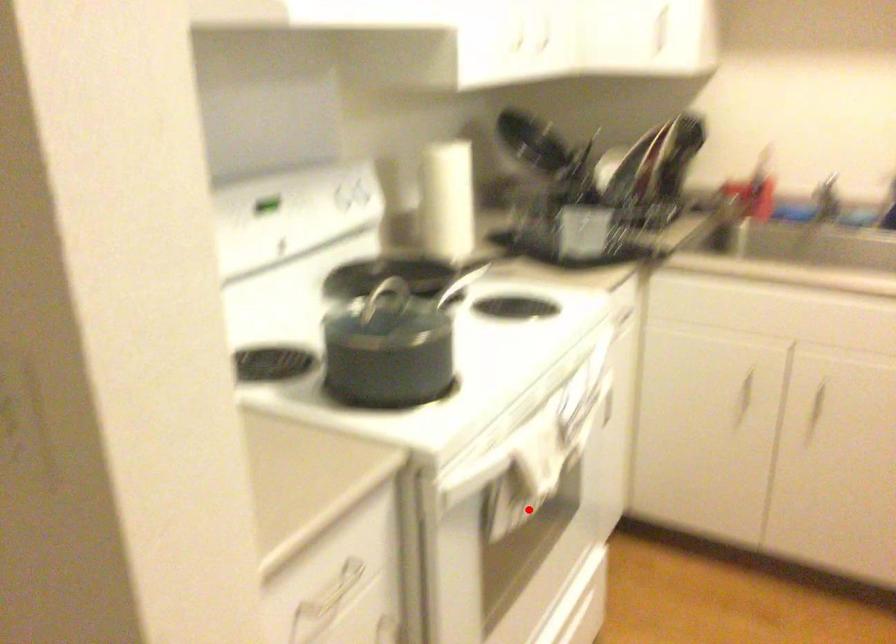
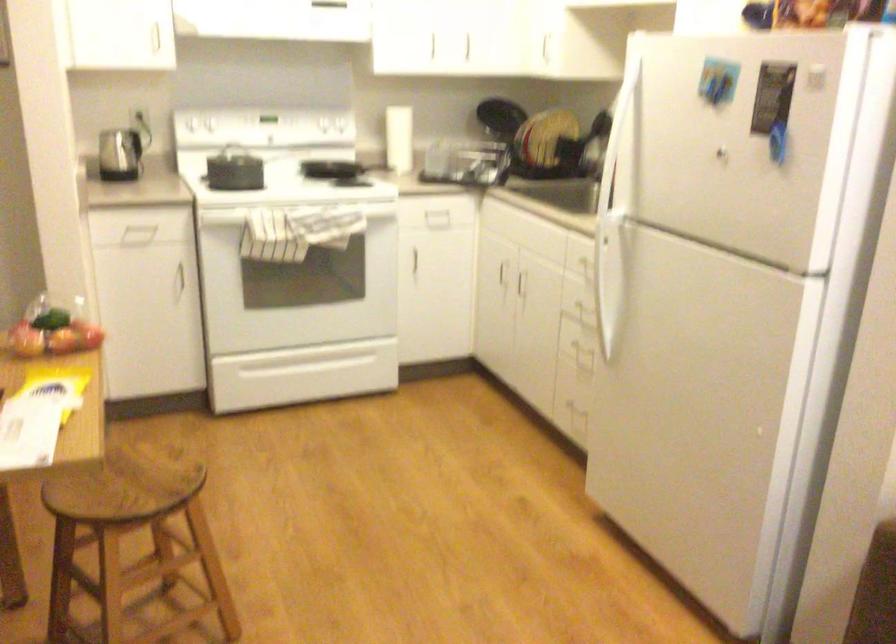
Question: I am providing you with two images of the same scene from different viewpoints. Image1 has a red point marked. In image2, the corresponding 3D location appears at what relative position? Reply with the corresponding letter.

Choices:
 (A) Closer
 (B) Farther

Answer: (B)